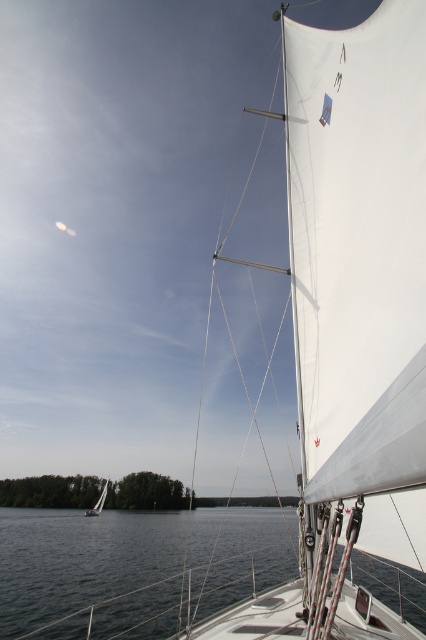
Does point (123, 584) lie in front of point (97, 502)?

Yes, it is.

Who is higher up, dark blue water at lower center or white matte sailboat at lower left?

dark blue water at lower center

Who is more distant from viewer, [244,520] or [94,508]?

Point [94,508]

You are a GUI agent. You are given a task and a screenshot of the screen. Output one action in this format:
    pyautogui.click(x=<x>, y=<y>)
    Task: Click on the dark blue water at lower center
    Image resolution: width=426 pixels, height=640 pixels.
    Given the screenshot: What is the action you would take?
    coord(89,572)